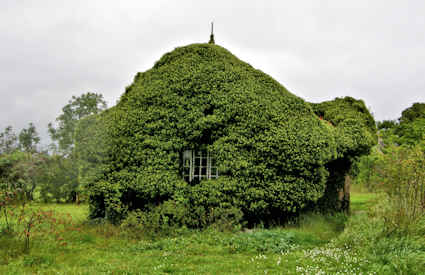
At what (x,y) coordinates should I click in order to perform the action: click on window. Please return your answer as a coordinate pair (x, y). The width and height of the screenshot is (425, 275). Looking at the image, I should click on (203, 163).